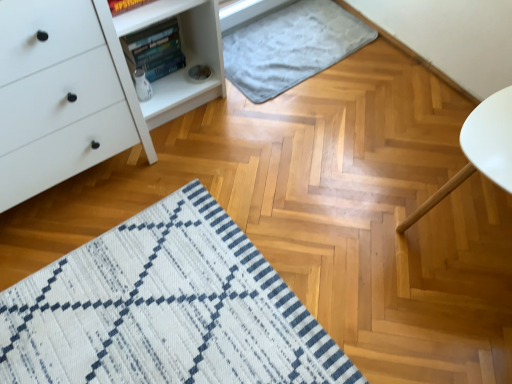
In order to click on free space in front of gray soft rug at upper center in this screenshot , I will do `click(304, 130)`.